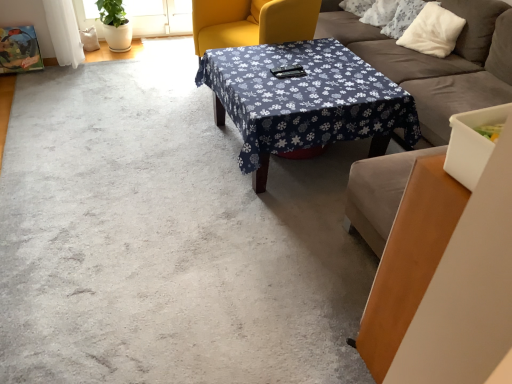
Question: Does matte yellow swivel chair at center have a larger size compared to white fluffy pillow at upper right?

Choices:
 (A) no
 (B) yes

Answer: (B)

Question: Is white fluffy pillow at upper right a part of matte yellow swivel chair at center?

Choices:
 (A) no
 (B) yes

Answer: (A)

Question: Does matte yellow swivel chair at center appear on the left side of white fluffy pillow at upper right?

Choices:
 (A) yes
 (B) no

Answer: (A)

Question: Can you see matte yellow swivel chair at center touching white fluffy pillow at upper right?

Choices:
 (A) yes
 (B) no

Answer: (B)

Question: Is matte yellow swivel chair at center far from white fluffy pillow at upper right?

Choices:
 (A) no
 (B) yes

Answer: (B)

Question: Based on their sizes in the image, would you say matte yellow swivel chair at center is bigger or smaller than blue fabric-covered table at center?

Choices:
 (A) small
 (B) big

Answer: (B)

Question: Visually, is matte yellow swivel chair at center positioned to the left or to the right of blue fabric-covered table at center?

Choices:
 (A) right
 (B) left

Answer: (B)

Question: From the image's perspective, is matte yellow swivel chair at center positioned above or below blue fabric-covered table at center?

Choices:
 (A) above
 (B) below

Answer: (A)

Question: Is matte yellow swivel chair at center situated inside blue fabric-covered table at center or outside?

Choices:
 (A) outside
 (B) inside

Answer: (A)

Question: In terms of height, does soft gray fabric couch at center look taller or shorter compared to blue fabric-covered table at center?

Choices:
 (A) short
 (B) tall

Answer: (B)

Question: Considering their positions, is soft gray fabric couch at center located in front of or behind blue fabric-covered table at center?

Choices:
 (A) behind
 (B) front

Answer: (B)

Question: From a real-world perspective, is soft gray fabric couch at center above or below blue fabric-covered table at center?

Choices:
 (A) below
 (B) above

Answer: (B)

Question: Based on their sizes in the image, would you say soft gray fabric couch at center is bigger or smaller than blue fabric-covered table at center?

Choices:
 (A) big
 (B) small

Answer: (A)

Question: Is point (448, 99) positioned closer to the camera than point (209, 1)?

Choices:
 (A) farther
 (B) closer

Answer: (B)

Question: Is soft gray fabric couch at center inside the boundaries of matte yellow swivel chair at center, or outside?

Choices:
 (A) outside
 (B) inside

Answer: (A)